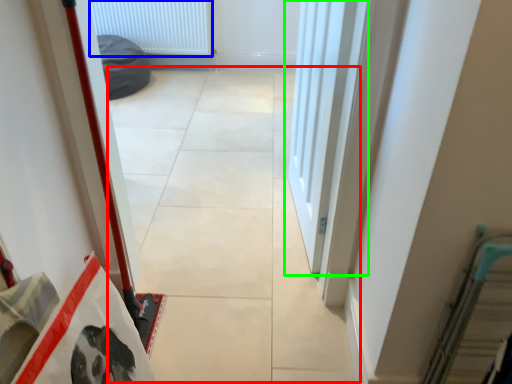
Question: Considering the real-world distances, which object is farthest from concrete (highlighted by a red box)? radiator (highlighted by a blue box) or door (highlighted by a green box)?

Choices:
 (A) radiator
 (B) door

Answer: (A)